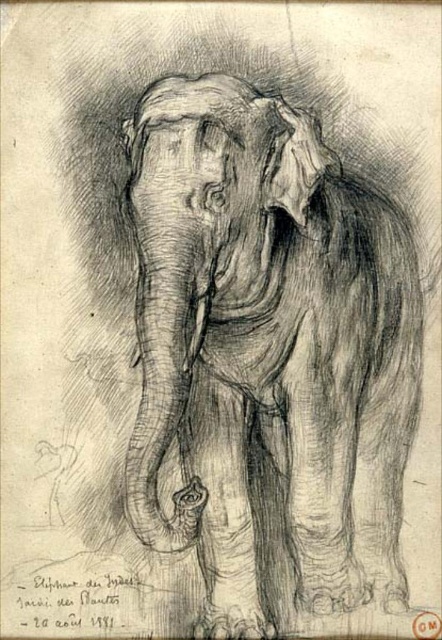
Who is taller, charcoal sketch elephant at center or charcoal textured elephant head at center?

With more height is charcoal sketch elephant at center.

Is point (342, 349) in front of point (217, 131)?

No, (342, 349) is further to viewer.

What do you see at coordinates (267, 355) in the screenshot? I see `charcoal sketch elephant at center` at bounding box center [267, 355].

Where is `charcoal sketch elephant at center`? Image resolution: width=442 pixels, height=640 pixels. charcoal sketch elephant at center is located at coordinates (267, 355).